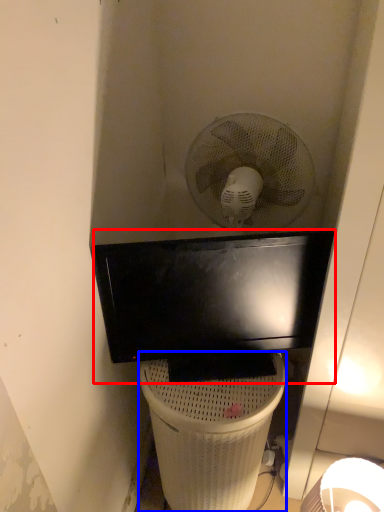
Question: Which point is further to the camera, television (highlighted by a red box) or trash bin/can (highlighted by a blue box)?

Choices:
 (A) television
 (B) trash bin/can

Answer: (B)